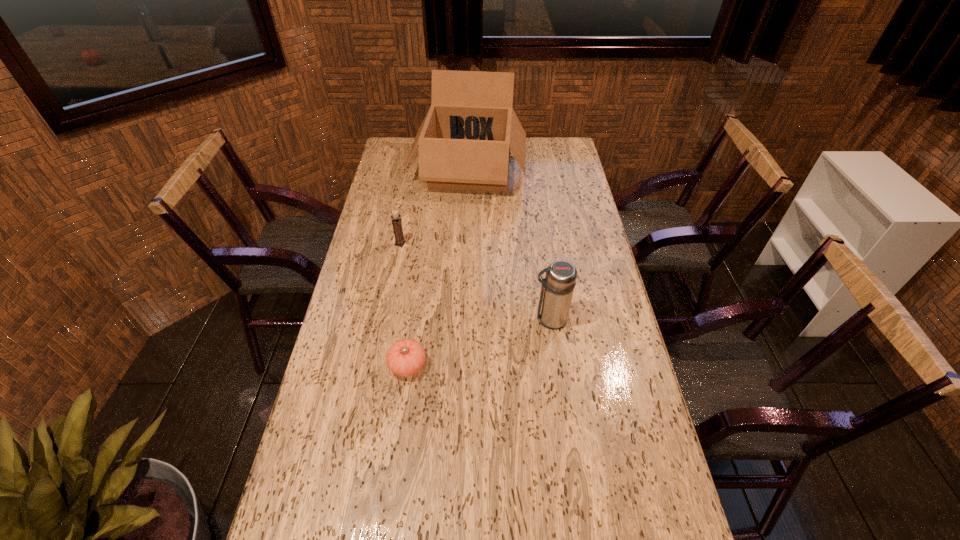
This screenshot has width=960, height=540. In order to click on the tallest object in this screenshot , I will do `click(465, 139)`.

Where is `box`? This screenshot has width=960, height=540. box is located at coordinates (465, 139).

I want to click on the third farthest object, so click(x=557, y=288).

The image size is (960, 540). I want to click on thermos bottle, so click(557, 288).

At what (x,y) coordinates should I click in order to perform the action: click on the third nearest object. Please return your answer as a coordinate pair (x, y). Looking at the image, I should click on (397, 226).

At what (x,y) coordinates should I click in order to perform the action: click on candle holder. Please return your answer as a coordinate pair (x, y). Looking at the image, I should click on (397, 226).

Locate an element on the screen. This screenshot has height=540, width=960. the nearest object is located at coordinates (406, 357).

Image resolution: width=960 pixels, height=540 pixels. In order to click on tomato in this screenshot , I will do [x=406, y=357].

In order to click on free space located 0.210m on the front of the farthest object in this screenshot , I will do `click(467, 236)`.

Identify the location of vacant space positioned 0.270m with a handle on the side of the third farthest object. (446, 319).